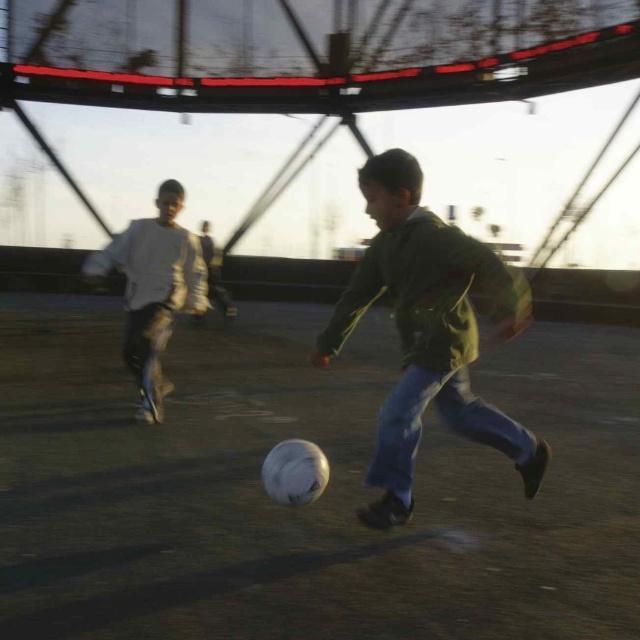
Which is behind, point (474, 397) or point (154, 342)?

The point (154, 342) is more distant.

Looking at this image, can you confirm if green matte jacket at center is positioned below white matte shirt at left?

Yes, green matte jacket at center is below white matte shirt at left.

Is point (397, 216) behind point (148, 388)?

No, it is not.

Where is `green matte jacket at center`? green matte jacket at center is located at coordinates (428, 332).